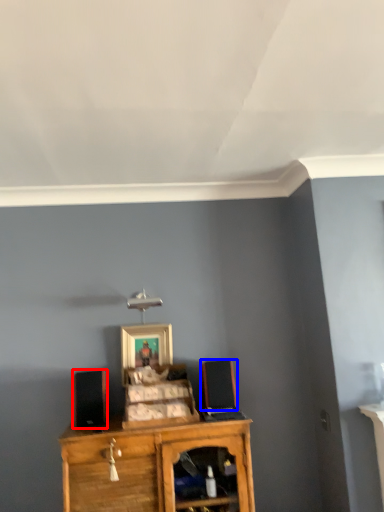
Question: Among these objects, which one is nearest to the camera, speaker (highlighted by a red box) or speaker (highlighted by a blue box)?

Choices:
 (A) speaker
 (B) speaker

Answer: (A)